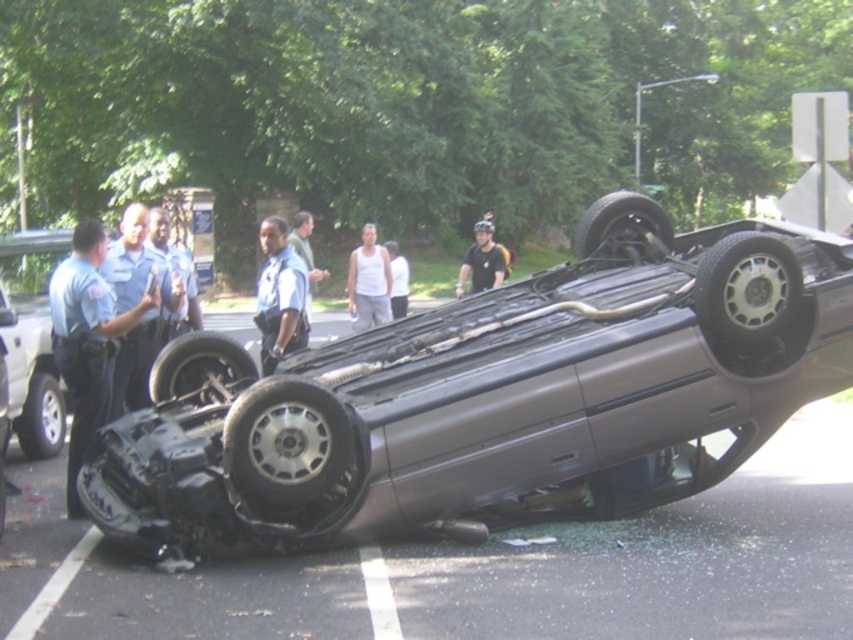
Can you confirm if dark blue uniform at left is bigger than blue uniform shirt at center?

Incorrect, dark blue uniform at left is not larger than blue uniform shirt at center.

Is dark blue uniform at left below blue uniform shirt at center?

Yes.

Does point (107, 346) lie in front of point (259, 275)?

Yes.

The image size is (853, 640). Find the location of `dark blue uniform at left`. dark blue uniform at left is located at coordinates click(x=86, y=340).

Who is positioned more to the right, silver metallic car at center or white tank top at center?

silver metallic car at center

Between silver metallic car at center and white tank top at center, which one appears on the left side from the viewer's perspective?

white tank top at center is more to the left.

Who is more distant from viewer, (196, 464) or (375, 257)?

The point (375, 257) is more distant.

The image size is (853, 640). Identify the location of silver metallic car at center. (492, 394).

Does blue uniform at left appear on the right side of white matte shirt at center?

In fact, blue uniform at left is to the left of white matte shirt at center.

Does blue uniform at left appear on the left side of white matte shirt at center?

Indeed, blue uniform at left is positioned on the left side of white matte shirt at center.

The height and width of the screenshot is (640, 853). What do you see at coordinates (132, 307) in the screenshot?
I see `blue uniform at left` at bounding box center [132, 307].

Identify the location of blue uniform at left. (132, 307).